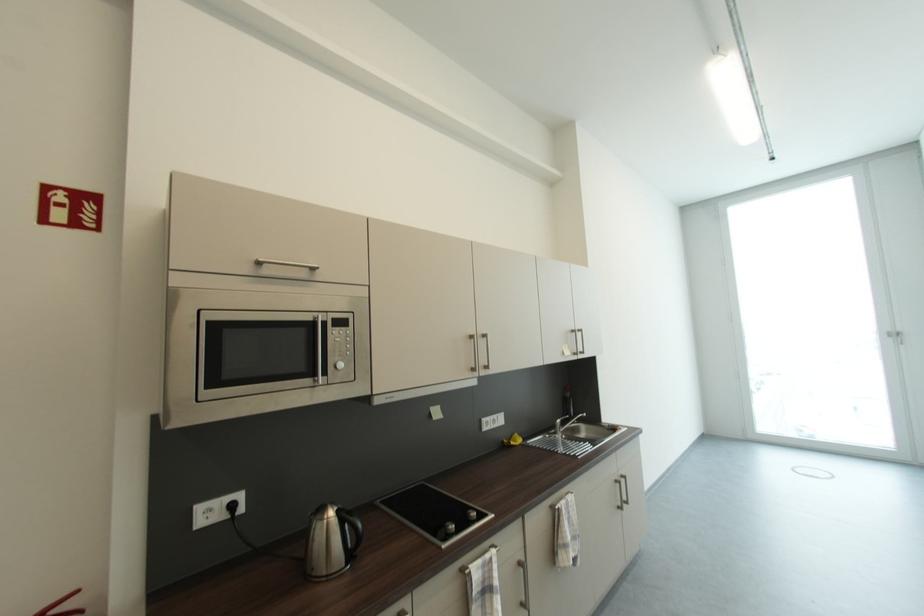
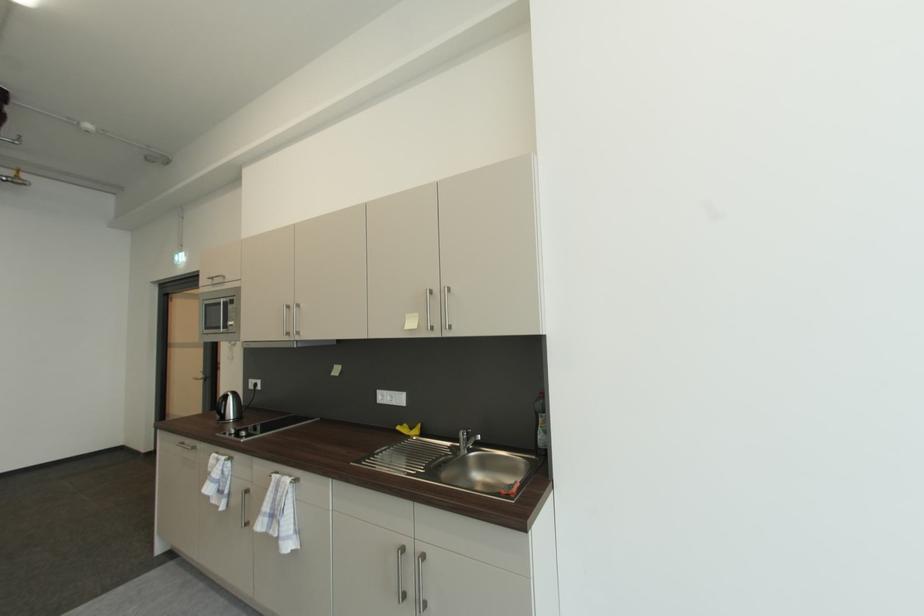
Find the pixel in the second image that matches the point at 578,408 in the first image.

(545, 430)